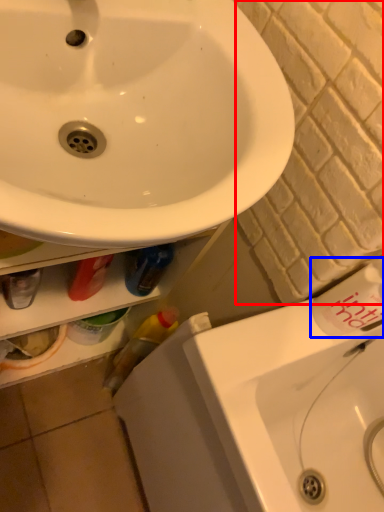
Question: Which point is closer to the camera, brick (highlighted by a red box) or toiletry (highlighted by a blue box)?

Choices:
 (A) brick
 (B) toiletry

Answer: (A)